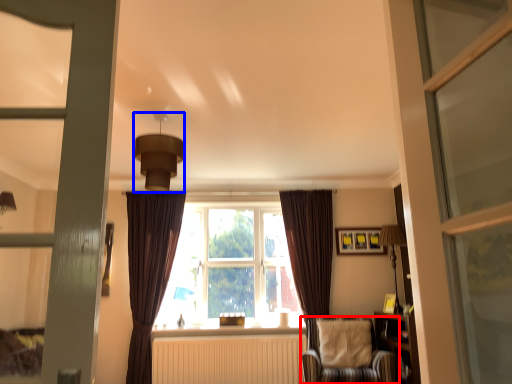
Question: Among these objects, which one is farthest to the camera, chair (highlighted by a red box) or light fixture (highlighted by a blue box)?

Choices:
 (A) chair
 (B) light fixture

Answer: (A)